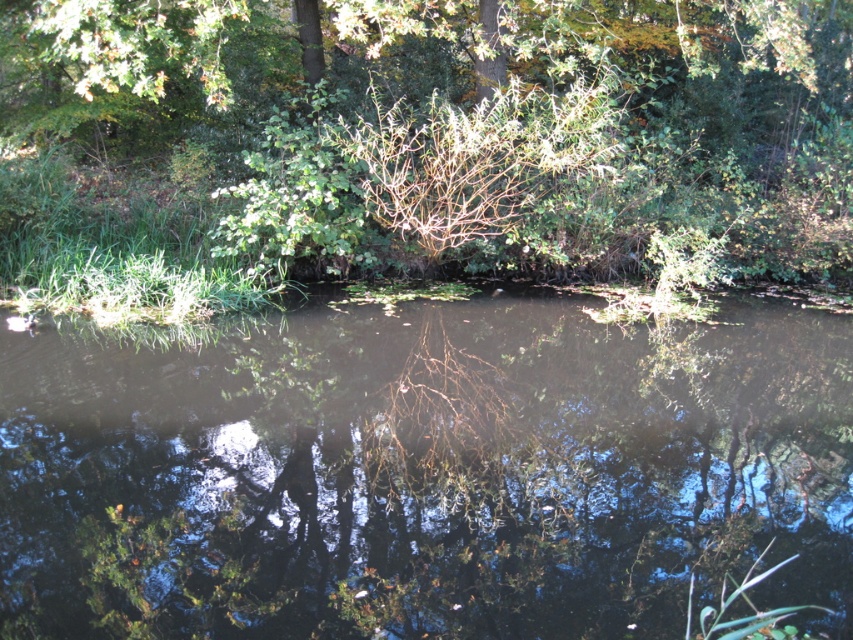
Between point (720, 376) and point (375, 56), which one is positioned in front?

Positioned in front is point (720, 376).

Is transparent water at center bigger than green leafy bush at upper center?

No.

Is point (112, 340) farther from camera compared to point (822, 90)?

That is False.

What are the coordinates of `transparent water at center` in the screenshot? It's located at (422, 472).